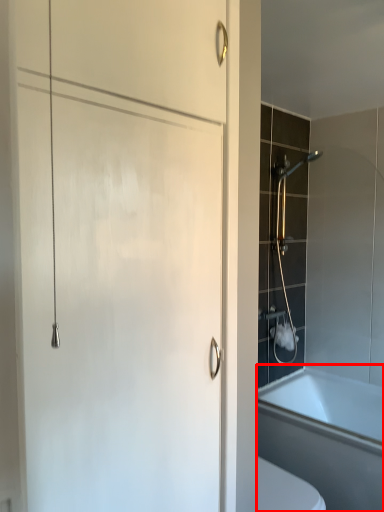
Question: Considering the relative positions of bathtub (annotated by the red box) and shower in the image provided, where is bathtub (annotated by the red box) located with respect to the staircase?

Choices:
 (A) right
 (B) left

Answer: (A)